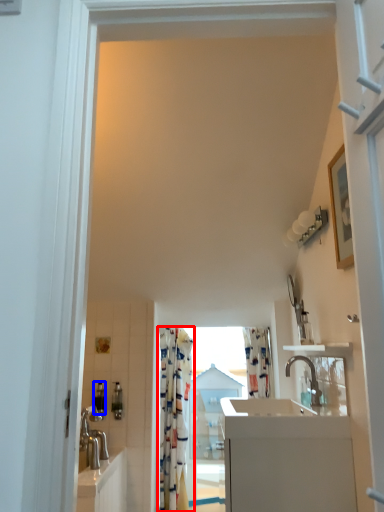
Question: Which object appears closest to the camera in this image, curtain (highlighted by a red box) or toiletry (highlighted by a blue box)?

Choices:
 (A) curtain
 (B) toiletry

Answer: (B)